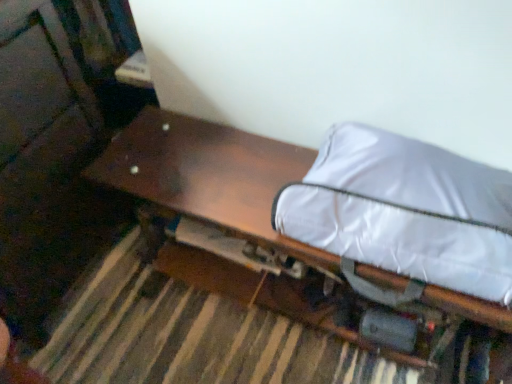
Question: Visually, is white fabric bean bag at right positioned to the left or to the right of wooden bench at center?

Choices:
 (A) right
 (B) left

Answer: (A)

Question: Considering the positions of white fabric bean bag at right and wooden bench at center in the image, is white fabric bean bag at right taller or shorter than wooden bench at center?

Choices:
 (A) tall
 (B) short

Answer: (B)

Question: Considering the positions of white fabric bean bag at right and wooden bench at center in the image, is white fabric bean bag at right wider or thinner than wooden bench at center?

Choices:
 (A) wide
 (B) thin

Answer: (B)

Question: From the image's perspective, is wooden bench at center positioned above or below white fabric bean bag at right?

Choices:
 (A) below
 (B) above

Answer: (A)

Question: In the image, is wooden bench at center positioned in front of or behind white fabric bean bag at right?

Choices:
 (A) front
 (B) behind

Answer: (B)

Question: Is wooden bench at center bigger or smaller than white fabric bean bag at right?

Choices:
 (A) small
 (B) big

Answer: (B)

Question: Looking at their shapes, would you say wooden bench at center is wider or thinner than white fabric bean bag at right?

Choices:
 (A) wide
 (B) thin

Answer: (A)